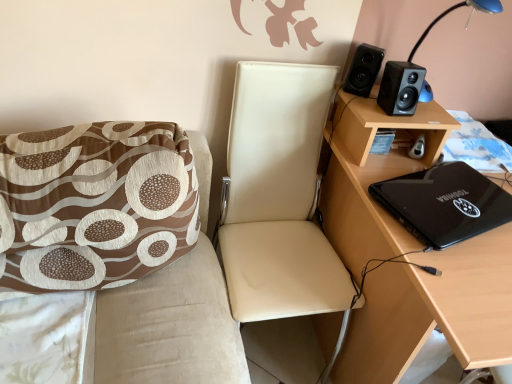
This screenshot has height=384, width=512. I want to click on free point to the right of black matte speaker at upper right, the 2th speaker viewed from the left, so click(430, 117).